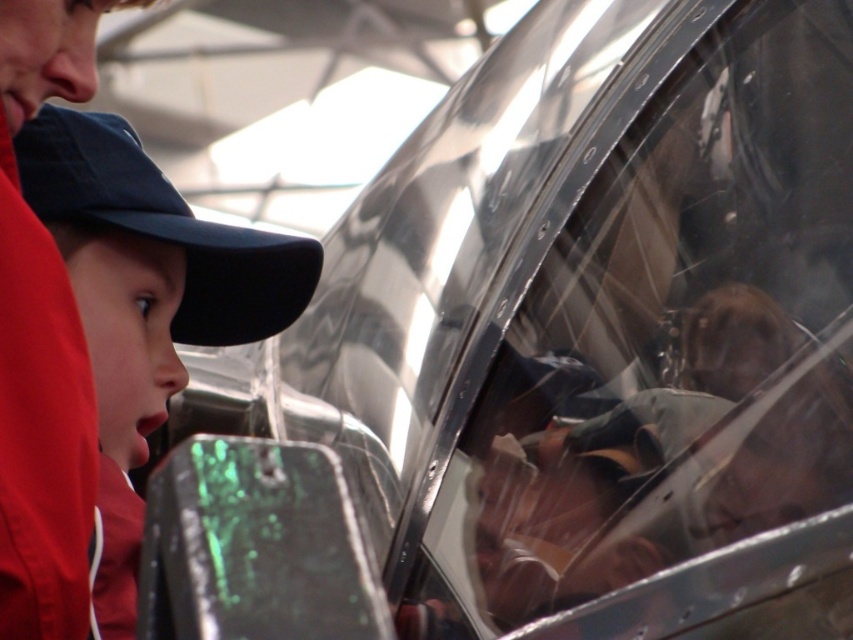
You are standing in front of a reflective metallic object and want to touch the point at coordinates point (57, 170). Can you reach it without moving your position?

The distance of point (57, 170) from camera is 13.30 feet, which is too far to reach without moving closer. You cannot touch it from your current position.

You are a safety inspector checking the equipment in the cockpit. You see the matte black cap at left and the matte black helmet at center. Which one is closer to the cockpit entrance?

The matte black cap at left is closer to the cockpit entrance because the matte black helmet at center is behind it, meaning the cap is in front and nearer to the entrance.